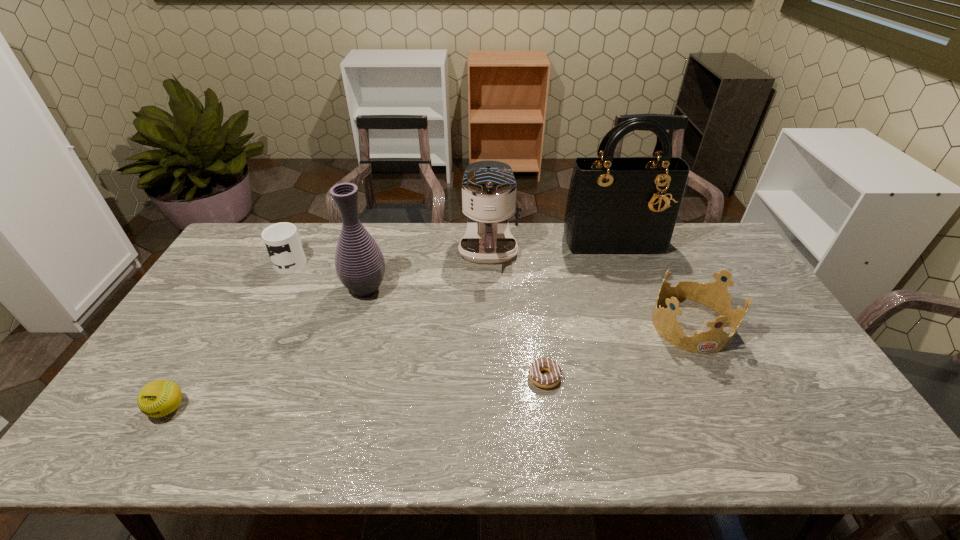
Find the location of a particular element. The image size is (960, 540). handbag is located at coordinates (623, 206).

The height and width of the screenshot is (540, 960). I want to click on the third object from left to right, so click(x=360, y=266).

Find the location of a particular element. The width and height of the screenshot is (960, 540). vase is located at coordinates (360, 266).

Identify the location of coffee maker. Image resolution: width=960 pixels, height=540 pixels. (489, 188).

Locate an element on the screen. tiara is located at coordinates (715, 295).

Locate an element on the screen. the sixth object from right to left is located at coordinates (283, 241).

Image resolution: width=960 pixels, height=540 pixels. Find the location of `the nearest object`. the nearest object is located at coordinates (158, 398).

At what (x,y) coordinates should I click in order to perform the action: click on the leftmost object. Please return your answer as a coordinate pair (x, y). The width and height of the screenshot is (960, 540). Looking at the image, I should click on (158, 398).

At what (x,y) coordinates should I click in order to perform the action: click on the shortest object. Please return your answer as a coordinate pair (x, y). Looking at the image, I should click on (553, 378).

At what (x,y) coordinates should I click in order to perform the action: click on the second nearest object. Please return your answer as a coordinate pair (x, y). The image size is (960, 540). Looking at the image, I should click on (553, 378).